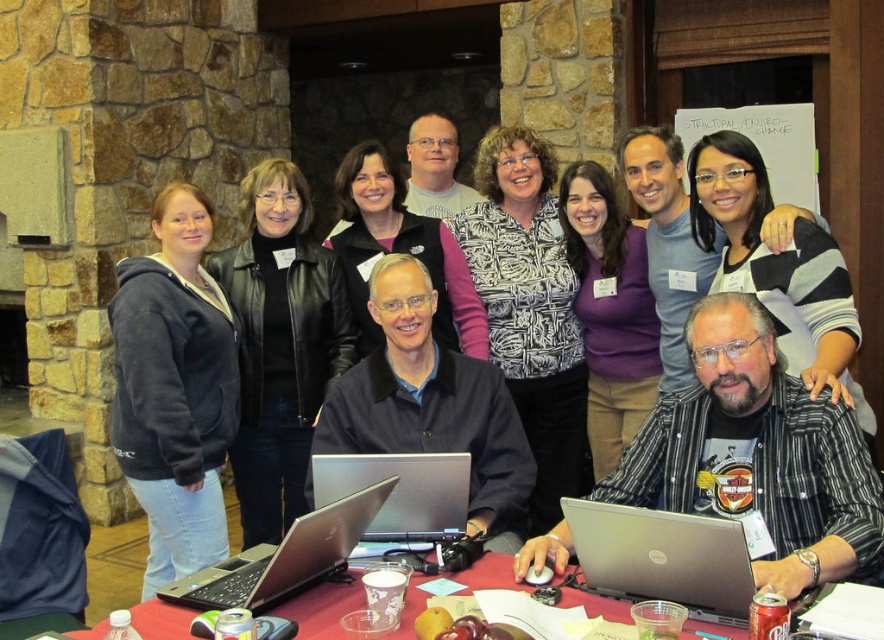
Between point (469, 333) and point (199, 588), which one is positioned behind?

Positioned behind is point (469, 333).

Between matte black jacket at center and silver metallic laptop at center, which one appears on the right side from the viewer's perspective?

From the viewer's perspective, matte black jacket at center appears more on the right side.

Who is more distant from viewer, (451,339) or (202,593)?

Point (451,339)

Where is `matte black jacket at center`? The image size is (884, 640). matte black jacket at center is located at coordinates (401, 250).

Does black leather jacket at upper left appear on the right side of silver metallic laptop at center?

In fact, black leather jacket at upper left is to the left of silver metallic laptop at center.

Between point (286, 196) and point (183, 596), which one is positioned behind?

The point (286, 196) is more distant.

Does point (252, 273) come farther from viewer compared to point (212, 600)?

Yes, point (252, 273) is farther from viewer.

Identify the location of black leather jacket at upper left. (280, 342).

Who is more forward, (363, 435) or (339, 616)?

Positioned in front is point (339, 616).

Consider the image. Who is shorter, black matte jacket at center or red plastic table at center?

With less height is red plastic table at center.

Between point (470, 502) and point (351, 596), which one is positioned in front?

Point (351, 596) is in front.

Find the location of a particular element. black matte jacket at center is located at coordinates (431, 403).